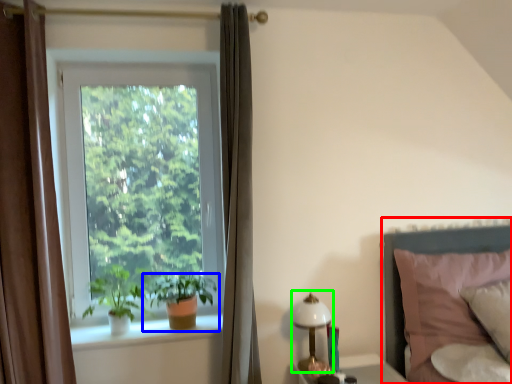
Question: Estimate the real-world distances between objects in this image. Which object is closer to bed (highlighted by a red box), houseplant (highlighted by a blue box) or bedside lamp (highlighted by a green box)?

Choices:
 (A) houseplant
 (B) bedside lamp

Answer: (B)